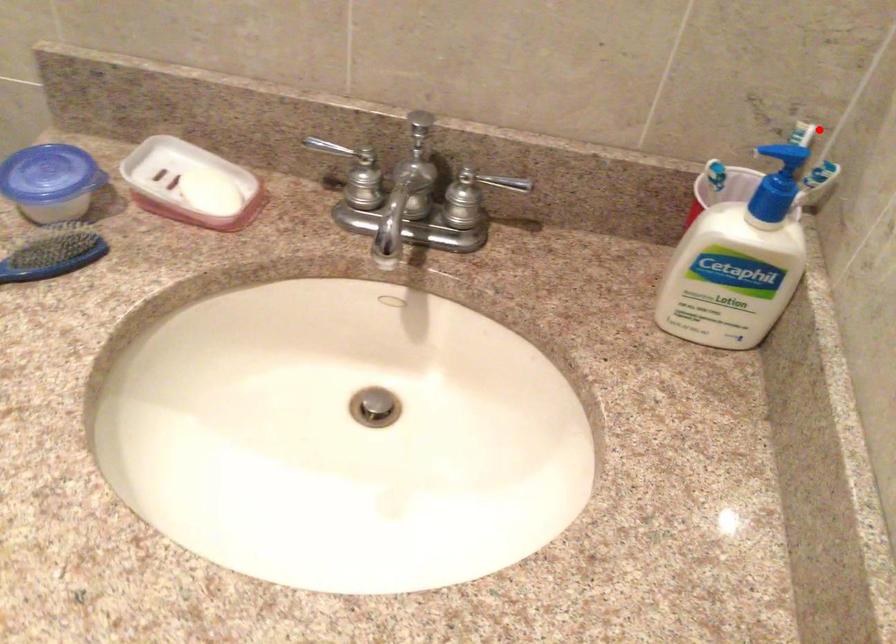
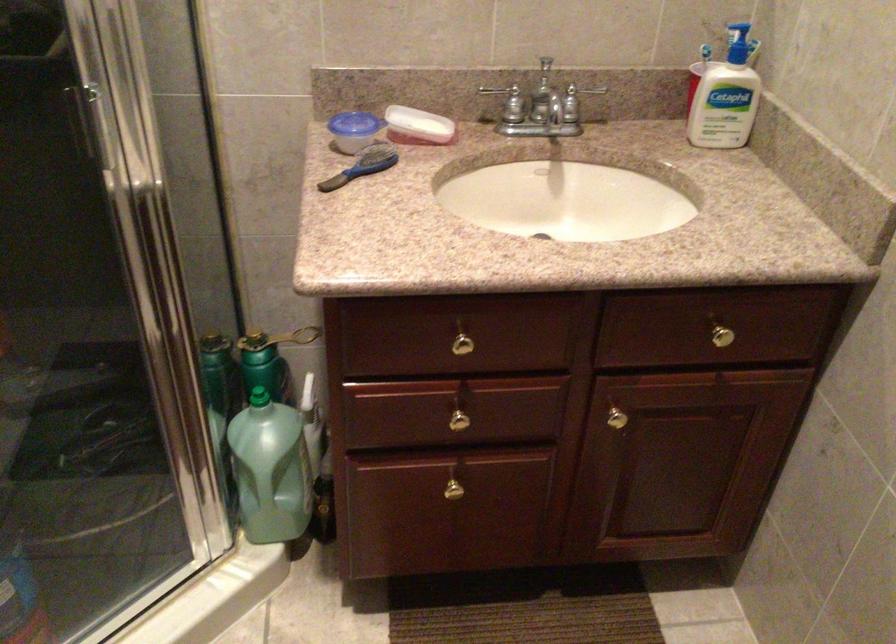
Question: A red point is marked in image1. In image2, is the corresponding 3D point closer to the camera or farther? Reply with the corresponding letter.

Choices:
 (A) The corresponding 3D point is closer.
 (B) The corresponding 3D point is farther.

Answer: (B)